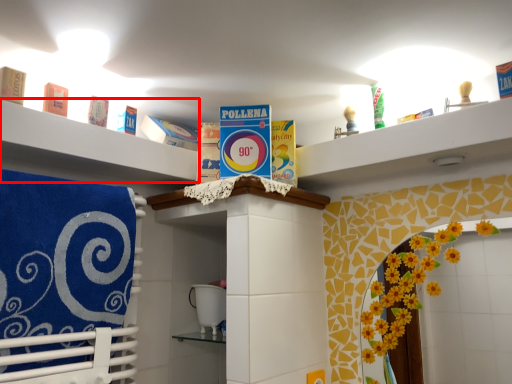
Question: From the image's perspective, considering the relative positions of shelf (annotated by the red box) and beach towel in the image provided, where is shelf (annotated by the red box) located with respect to the staircase?

Choices:
 (A) below
 (B) above

Answer: (B)